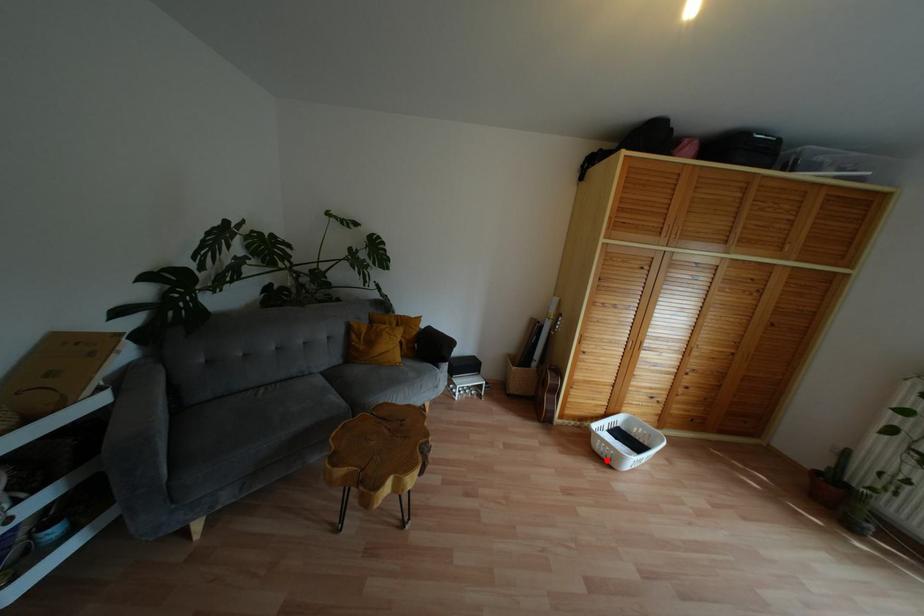
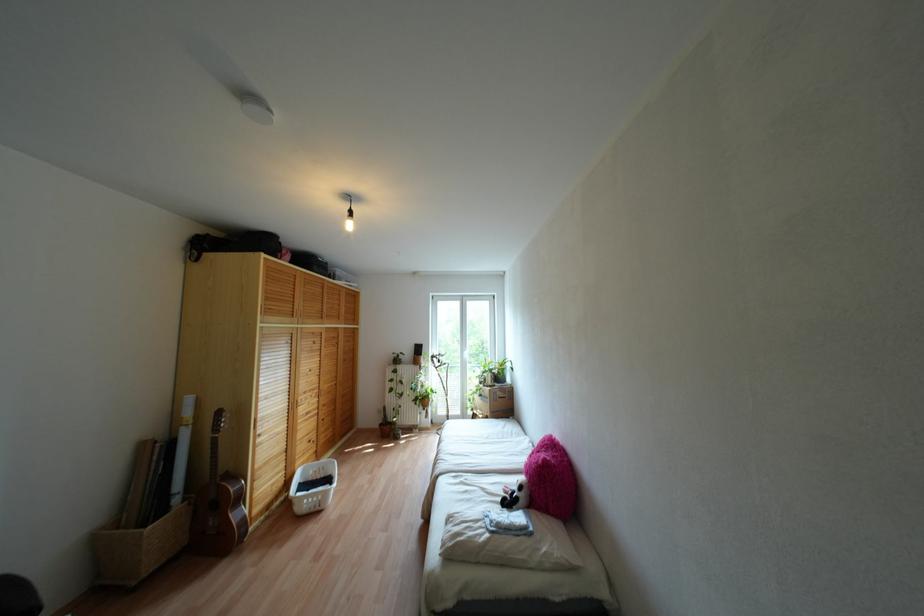
Question: I am providing you with two images of the same scene from different viewpoints. In image1, a red point is highlighted. Considering the same 3D point in image2, which of the following is correct?

Choices:
 (A) It is closer
 (B) It is farther

Answer: (B)